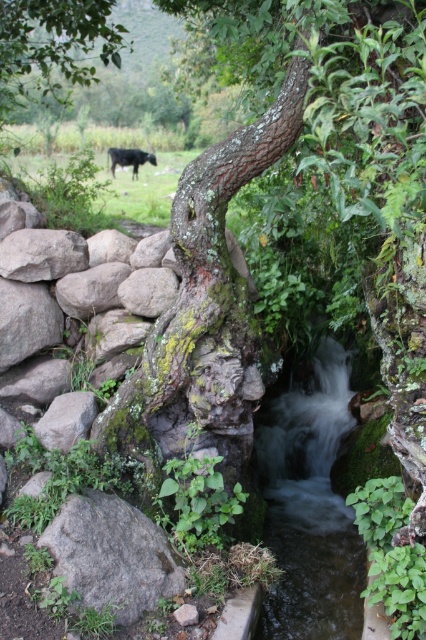
Can you confirm if lichen-covered bark tree trunk at center is positioned to the right of black glossy cow at center?

Indeed, lichen-covered bark tree trunk at center is positioned on the right side of black glossy cow at center.

Which of these two, lichen-covered bark tree trunk at center or black glossy cow at center, stands taller?

lichen-covered bark tree trunk at center

Between point (170, 433) and point (112, 157), which one is positioned behind?

Point (112, 157)

Image resolution: width=426 pixels, height=640 pixels. What are the coordinates of `lichen-covered bark tree trunk at center` in the screenshot? It's located at (204, 308).

Is gray rough rock at lower left further to camera compared to black glossy cow at center?

No, it is not.

Who is taller, gray rough rock at lower left or black glossy cow at center?

Standing taller between the two is gray rough rock at lower left.

The width and height of the screenshot is (426, 640). What are the coordinates of `gray rough rock at lower left` in the screenshot? It's located at (112, 556).

Is lichen-covered bark tree trunk at center above green mossy rock at lower left?

Correct, lichen-covered bark tree trunk at center is located above green mossy rock at lower left.

The height and width of the screenshot is (640, 426). In order to click on lichen-covered bark tree trunk at center in this screenshot , I will do `click(204, 308)`.